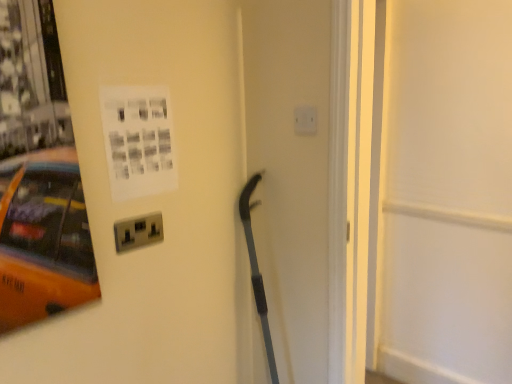
Question: Is white matte door at center wider than white plastic electric outlet at upper center, which appears as the 1th electric outlet when viewed from the right?

Choices:
 (A) no
 (B) yes

Answer: (B)

Question: Considering the relative sizes of white matte door at center and white plastic electric outlet at upper center, which is the second electric outlet from bottom to top, in the image provided, is white matte door at center smaller than white plastic electric outlet at upper center, which is the second electric outlet from bottom to top,?

Choices:
 (A) no
 (B) yes

Answer: (A)

Question: Is the depth of white matte door at center less than that of white plastic electric outlet at upper center, which is the second electric outlet in front-to-back order?

Choices:
 (A) yes
 (B) no

Answer: (A)

Question: From a real-world perspective, is white matte door at center on top of white plastic electric outlet at upper center, the second electric outlet in the left-to-right sequence?

Choices:
 (A) yes
 (B) no

Answer: (B)

Question: Are white matte door at center and white plastic electric outlet at upper center, which appears as the 1th electric outlet when viewed from the right, located far from each other?

Choices:
 (A) no
 (B) yes

Answer: (B)

Question: Does white matte door at center have a lesser width compared to white plastic electric outlet at upper center, the 1th electric outlet when ordered from back to front?

Choices:
 (A) yes
 (B) no

Answer: (B)

Question: Can you confirm if white matte door at center is taller than white paper at upper left?

Choices:
 (A) no
 (B) yes

Answer: (B)

Question: Is white matte door at center in front of white paper at upper left?

Choices:
 (A) no
 (B) yes

Answer: (B)

Question: Does white matte door at center appear on the left side of white paper at upper left?

Choices:
 (A) yes
 (B) no

Answer: (B)

Question: Is white matte door at center oriented away from white paper at upper left?

Choices:
 (A) yes
 (B) no

Answer: (B)

Question: From a real-world perspective, is white matte door at center located higher than white paper at upper left?

Choices:
 (A) yes
 (B) no

Answer: (B)

Question: Is white matte door at center far away from white paper at upper left?

Choices:
 (A) no
 (B) yes

Answer: (B)

Question: From the image's perspective, does white plastic electric outlet at upper center, the second electric outlet in the left-to-right sequence, appear higher than white matte door at center?

Choices:
 (A) no
 (B) yes

Answer: (B)